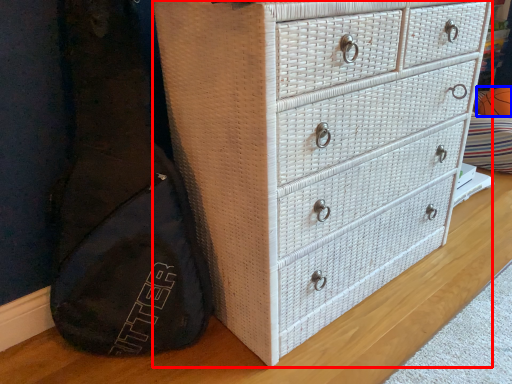
Question: Which object appears farthest to the camera in this image, chest of drawers (highlighted by a red box) or basketball (highlighted by a blue box)?

Choices:
 (A) chest of drawers
 (B) basketball

Answer: (B)